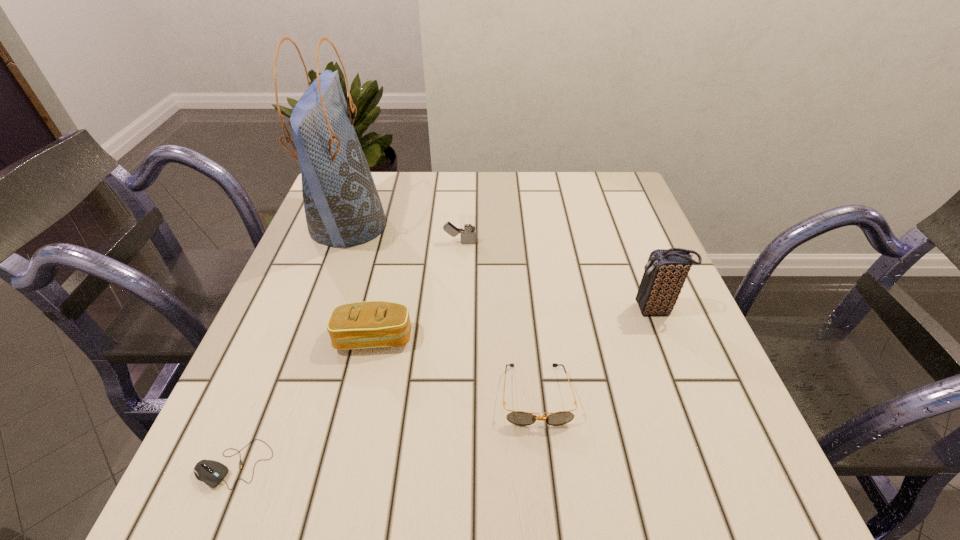
This screenshot has width=960, height=540. Identify the location of the tallest object. (342, 206).

Locate an element on the screen. The image size is (960, 540). the second tallest object is located at coordinates (666, 271).

Locate an element on the screen. The height and width of the screenshot is (540, 960). the third farthest object is located at coordinates (666, 271).

I want to click on igniter, so click(467, 222).

Find the location of a particular element. The height and width of the screenshot is (540, 960). the third nearest object is located at coordinates (372, 324).

Where is `the nearer clutch bag`? The height and width of the screenshot is (540, 960). the nearer clutch bag is located at coordinates (372, 324).

The height and width of the screenshot is (540, 960). Identify the location of sunglasses. (520, 418).

Where is `the second shortest object`? The width and height of the screenshot is (960, 540). the second shortest object is located at coordinates (520, 418).

At what (x,y) coordinates should I click in order to perform the action: click on the shortest object. Please return your answer as a coordinate pair (x, y). Looking at the image, I should click on (211, 472).

Where is `computer mouse`? This screenshot has width=960, height=540. computer mouse is located at coordinates (211, 472).